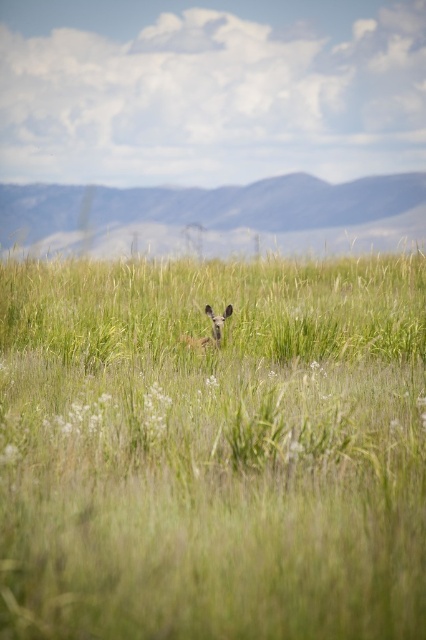
Question: Among these points, which one is farthest from the camera?

Choices:
 (A) pos(310,614)
 (B) pos(215,324)

Answer: (B)

Question: Does green grassy field at center have a lesser width compared to brown furry deer at center?

Choices:
 (A) no
 (B) yes

Answer: (A)

Question: Does green grassy field at center appear over brown furry deer at center?

Choices:
 (A) yes
 (B) no

Answer: (A)

Question: Observing the image, what is the correct spatial positioning of green grassy field at center in reference to brown furry deer at center?

Choices:
 (A) below
 (B) above

Answer: (B)